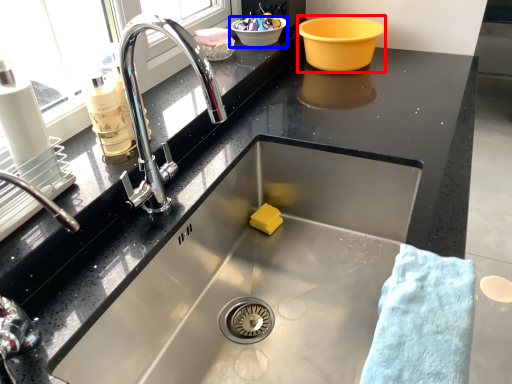
Question: Which point is further to the camera, basin (highlighted by a red box) or basin (highlighted by a blue box)?

Choices:
 (A) basin
 (B) basin

Answer: (B)